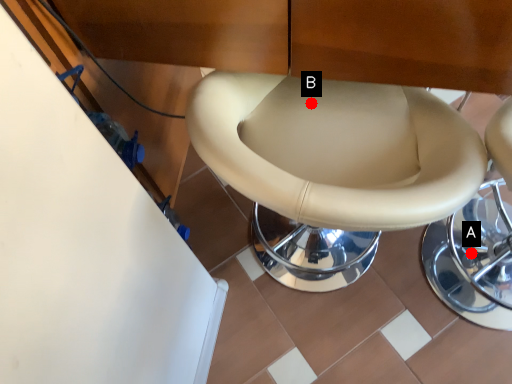
Question: Two points are circled on the image, labeled by A and B beside each circle. Which point is farther from the camera taking this photo?

Choices:
 (A) A is further
 (B) B is further

Answer: (A)